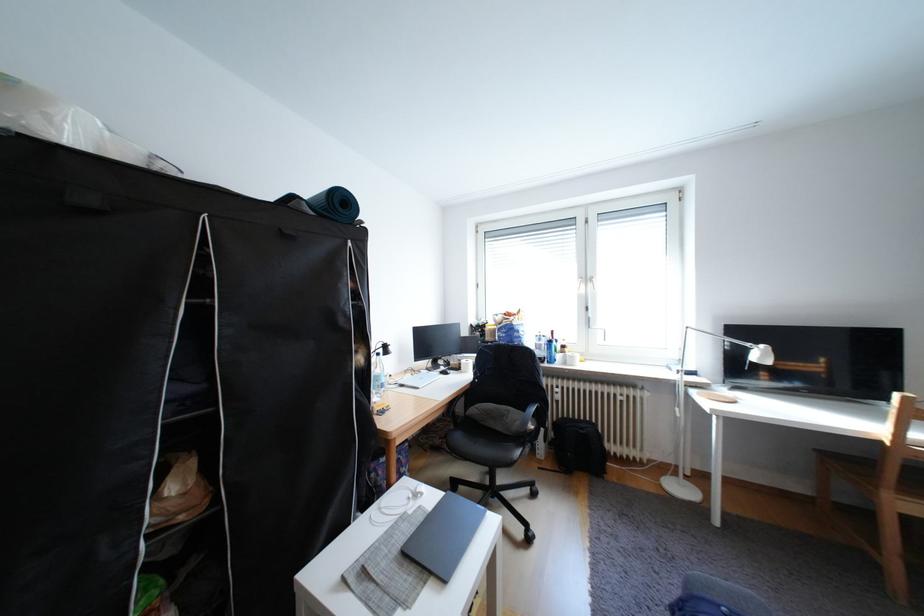
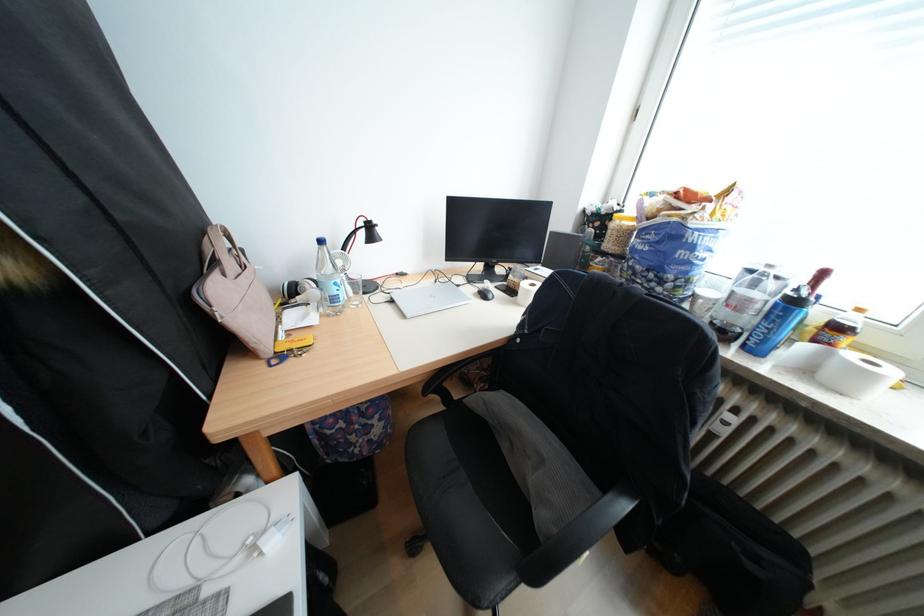
Question: I am providing you with two images of the same scene from different viewpoints. After the viewpoint changes to image2, which objects are now occluded?

Choices:
 (A) clear water bottle
 (B) chair sitting surface
 (C) beige handbag handle
 (D) none of these

Answer: (D)